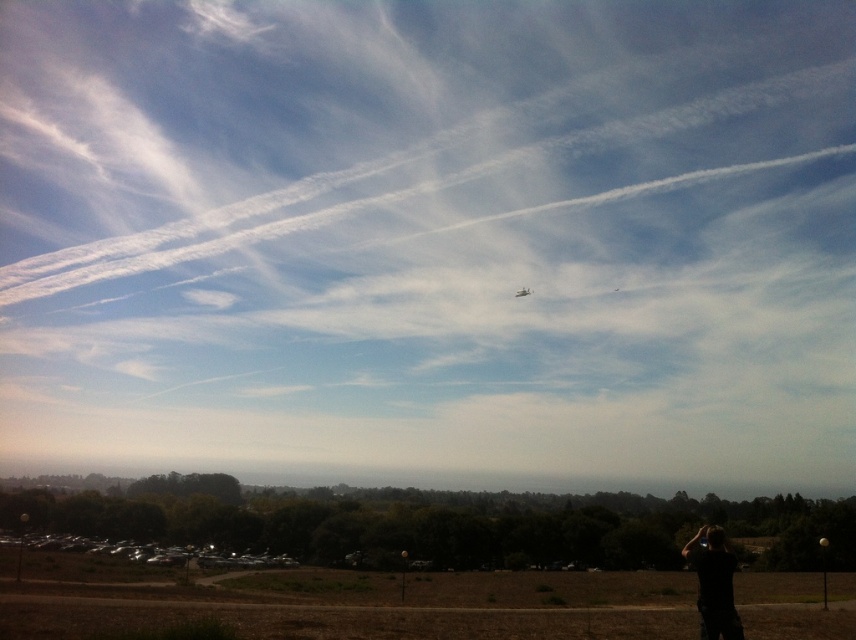
You are standing in the open landscape and want to take a photo of the metallic silver airplane at center. The black fabric person at lower right is blocking your view. Can you move to the right to get a clear shot?

The black fabric person at lower right is to the left of the metallic silver airplane at center, so moving to the right will position you behind the person, allowing you to see the airplane without obstruction.

You are a photographer trying to capture the metallic silver airplane at center in your shot. However, the black fabric person at lower right is blocking your view. Can you estimate if the person is wider than the airplane to determine if moving them would help?

The black fabric person at lower right might be wider than metallic silver airplane at center, so moving them could improve the view of the metallic silver airplane at center.